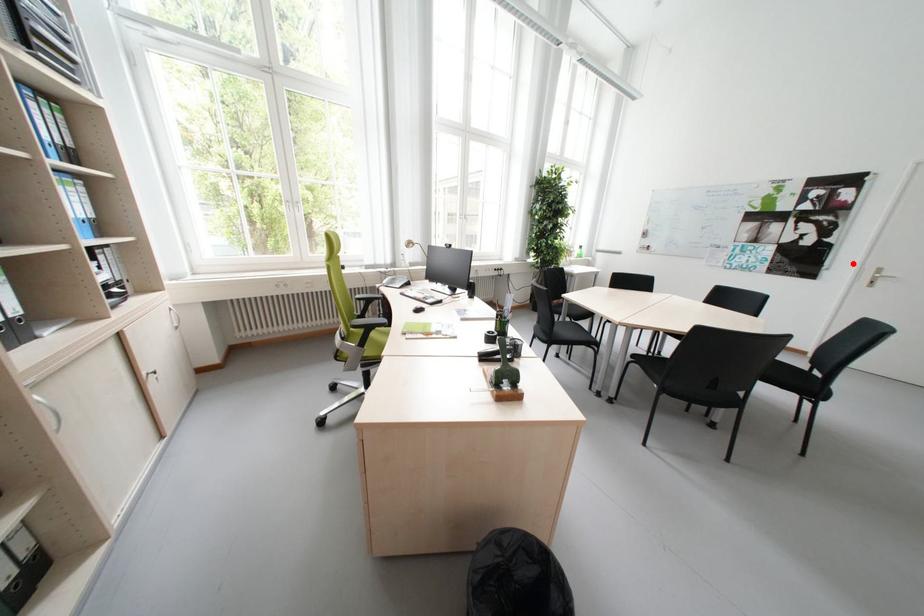
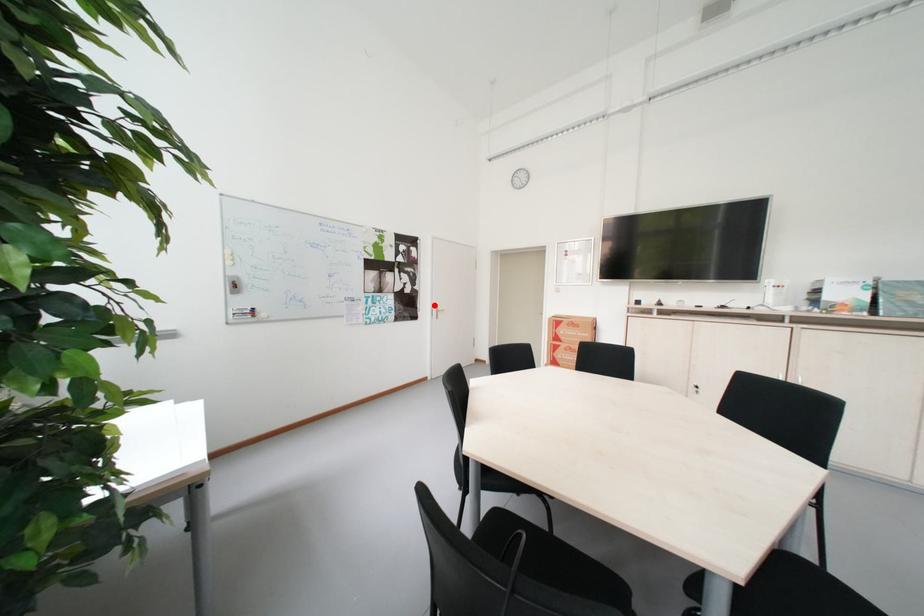
I am providing you with two images of the same scene from different viewpoints. A red point is marked on the first image and another point is marked on the second image. Do the highlighted points in image1 and image2 indicate the same real-world spot?

Yes